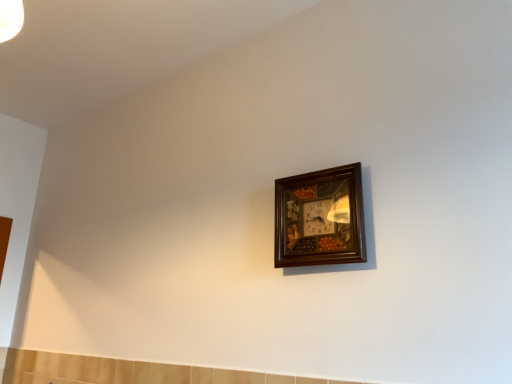
I want to click on wooden clock at upper center, so click(319, 218).

What do you see at coordinates (319, 218) in the screenshot?
I see `wooden clock at upper center` at bounding box center [319, 218].

The image size is (512, 384). In order to click on wooden clock at upper center in this screenshot , I will do `click(319, 218)`.